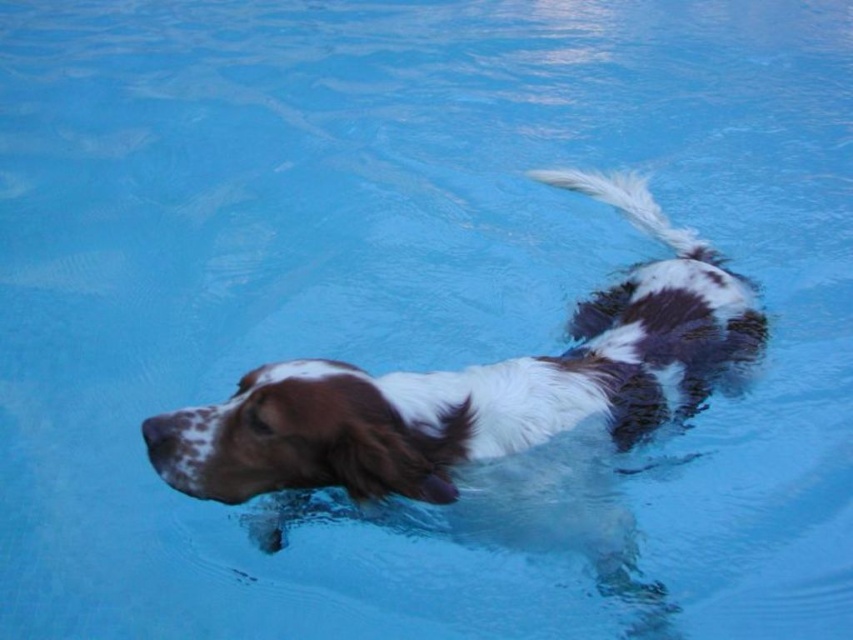
Does brown and white fur dog at center appear under white fluffy tail at upper right?

Yes.

Is brown and white fur dog at center above white fluffy tail at upper right?

Result: No, brown and white fur dog at center is not above white fluffy tail at upper right.

This screenshot has width=853, height=640. Identify the location of brown and white fur dog at center. (476, 394).